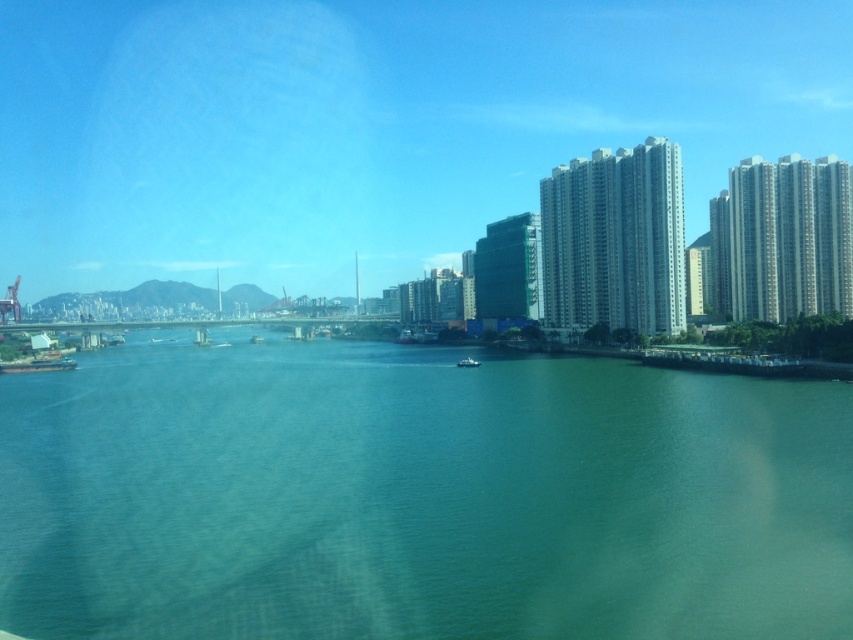
Question: Considering the relative positions of green water at center and white matte boat at center in the image provided, where is green water at center located with respect to white matte boat at center?

Choices:
 (A) below
 (B) above

Answer: (A)

Question: Considering the relative positions of green water at center and white matte boat at center in the image provided, where is green water at center located with respect to white matte boat at center?

Choices:
 (A) below
 (B) above

Answer: (A)

Question: Does green water at center have a larger size compared to white matte boat at center?

Choices:
 (A) yes
 (B) no

Answer: (A)